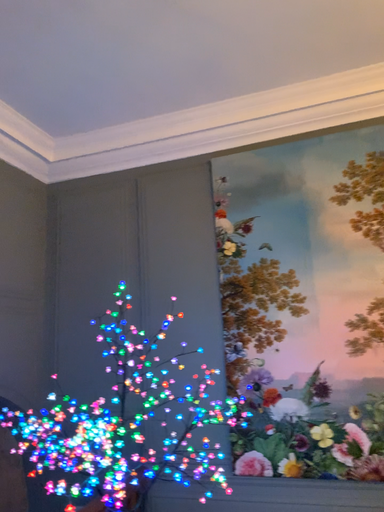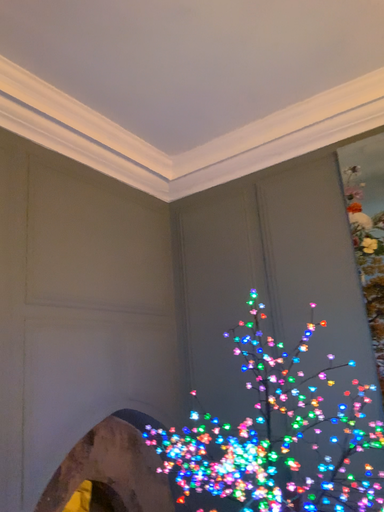
Question: How did the camera likely rotate when shooting the video?

Choices:
 (A) rotated left
 (B) rotated right

Answer: (A)